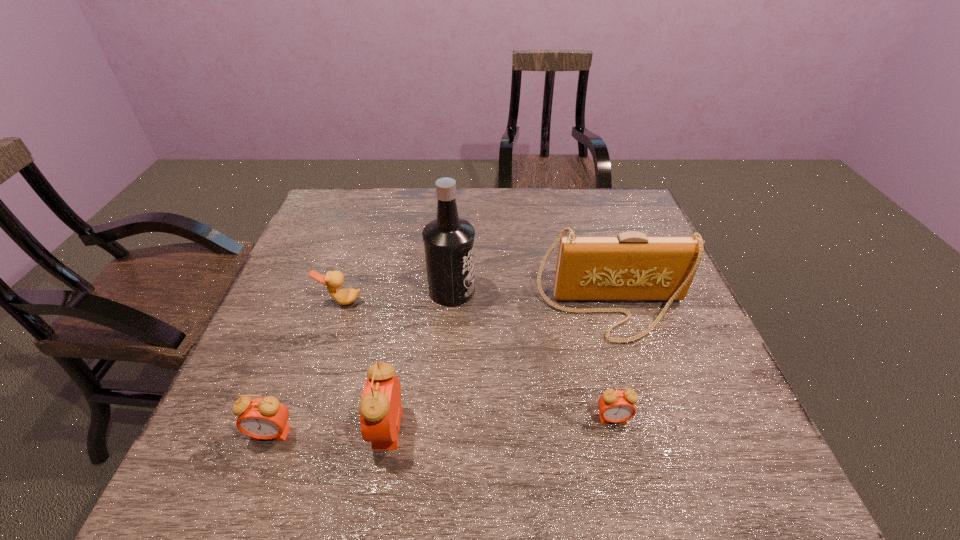
Locate an element on the screen. This screenshot has height=540, width=960. free space located on the face of the tallest alarm clock is located at coordinates (x=254, y=428).

Where is `vacant region located 0.250m on the face of the tallest alarm clock`? This screenshot has width=960, height=540. vacant region located 0.250m on the face of the tallest alarm clock is located at coordinates pyautogui.click(x=244, y=428).

Find the location of a particular element. The image size is (960, 540). free space located 0.260m on the front label of the liquor is located at coordinates (576, 291).

Where is `free space located on the decorative side of the handbag`? This screenshot has height=540, width=960. free space located on the decorative side of the handbag is located at coordinates (650, 434).

Locate an element on the screen. The height and width of the screenshot is (540, 960). vacant space situated on the beak of the duck is located at coordinates (314, 384).

The image size is (960, 540). I want to click on alarm clock present at the left edge, so click(x=266, y=418).

Identify the location of duck at the left edge. The width and height of the screenshot is (960, 540). (333, 279).

Where is `object that is at the right edge`? The image size is (960, 540). object that is at the right edge is located at coordinates (631, 266).

The height and width of the screenshot is (540, 960). Identify the location of object that is positioned at the near left corner. (266, 418).

At what (x,y) coordinates should I click in order to perform the action: click on vacant space at the far edge. Please return your answer as a coordinate pair (x, y). This screenshot has height=540, width=960. Looking at the image, I should click on (479, 207).